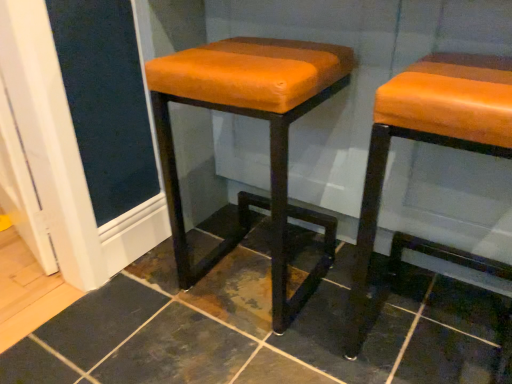
Question: From a real-world perspective, relative to orange leather stool at center, which ranks as the first stool in left-to-right order, is orange leather stool at right, the second stool viewed from the left, vertically above or below?

Choices:
 (A) above
 (B) below

Answer: (A)

Question: Is orange leather stool at right, the second stool viewed from the left, taller or shorter than orange leather stool at center, which appears as the 2th stool when viewed from the right?

Choices:
 (A) tall
 (B) short

Answer: (B)

Question: Is orange leather stool at right, which is the first stool from right to left, bigger or smaller than orange leather stool at center, which ranks as the first stool in left-to-right order?

Choices:
 (A) small
 (B) big

Answer: (A)

Question: From a real-world perspective, is orange leather stool at center, which ranks as the first stool in left-to-right order, positioned above or below orange leather stool at right, which is the first stool from right to left?

Choices:
 (A) above
 (B) below

Answer: (B)

Question: Considering the positions of orange leather stool at center, which ranks as the first stool in left-to-right order, and orange leather stool at right, the second stool viewed from the left, in the image, is orange leather stool at center, which ranks as the first stool in left-to-right order, taller or shorter than orange leather stool at right, the second stool viewed from the left,?

Choices:
 (A) tall
 (B) short

Answer: (A)

Question: Looking at the image, does orange leather stool at center, which appears as the 2th stool when viewed from the right, seem bigger or smaller compared to orange leather stool at right, which is the first stool from right to left?

Choices:
 (A) small
 (B) big

Answer: (B)

Question: Is point (197, 72) closer or farther from the camera than point (415, 112)?

Choices:
 (A) farther
 (B) closer

Answer: (A)